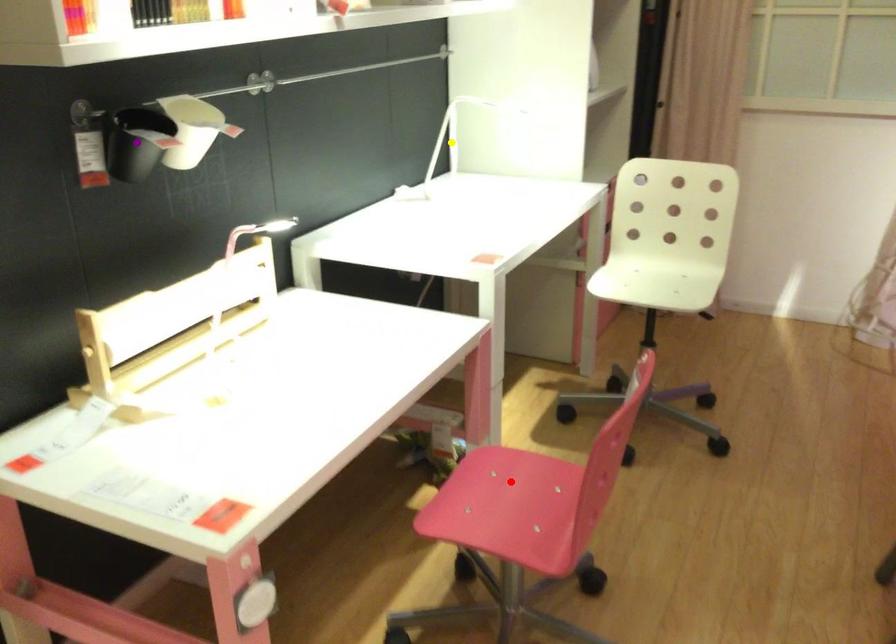
Order these from farthest to nearest:
purple point, red point, yellow point

yellow point < red point < purple point